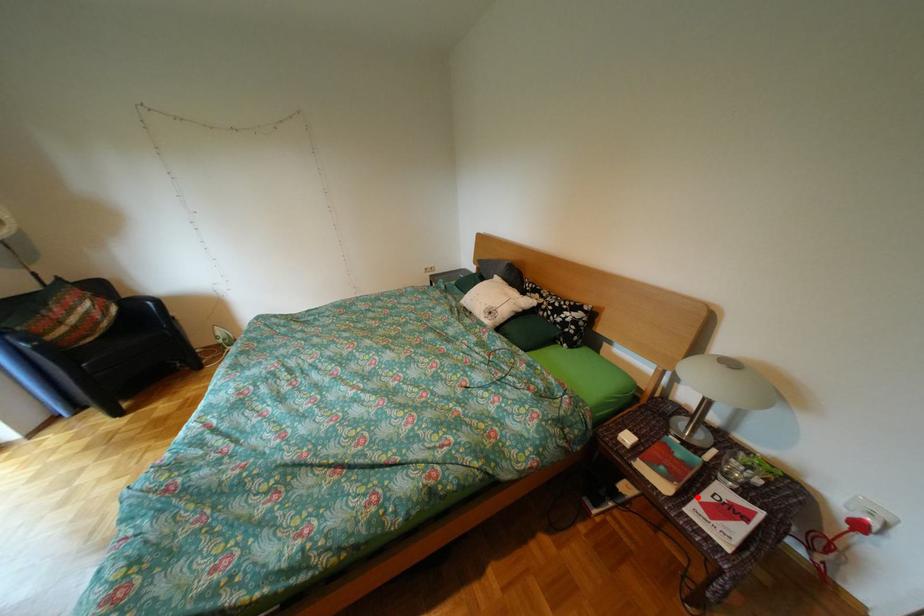
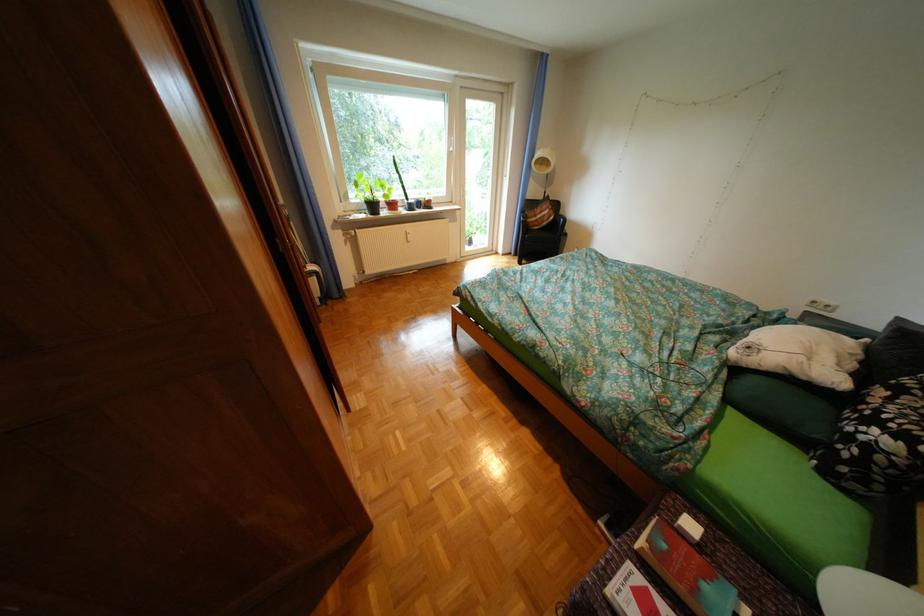
In the second image, find the point that corresponds to the highlighted location in the first image.

(658, 565)